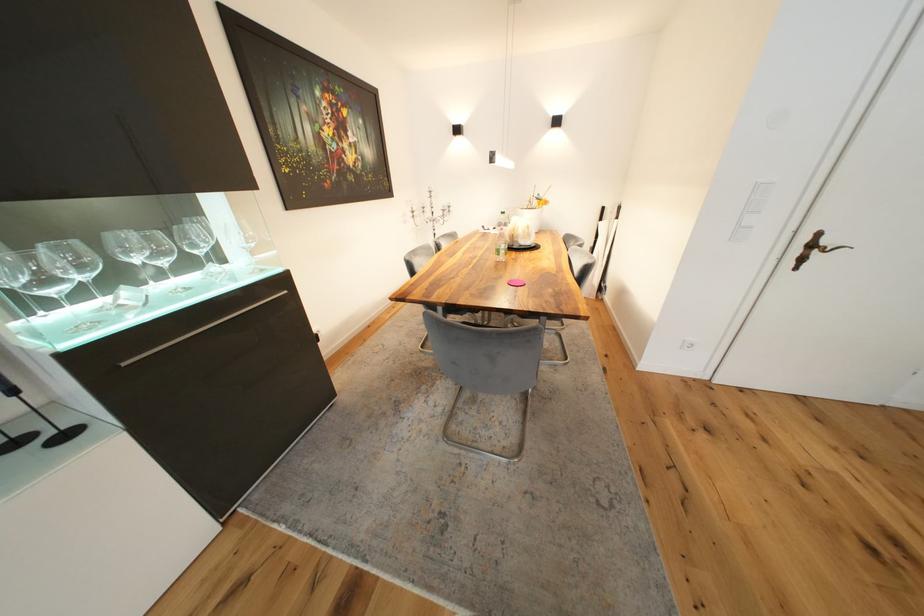
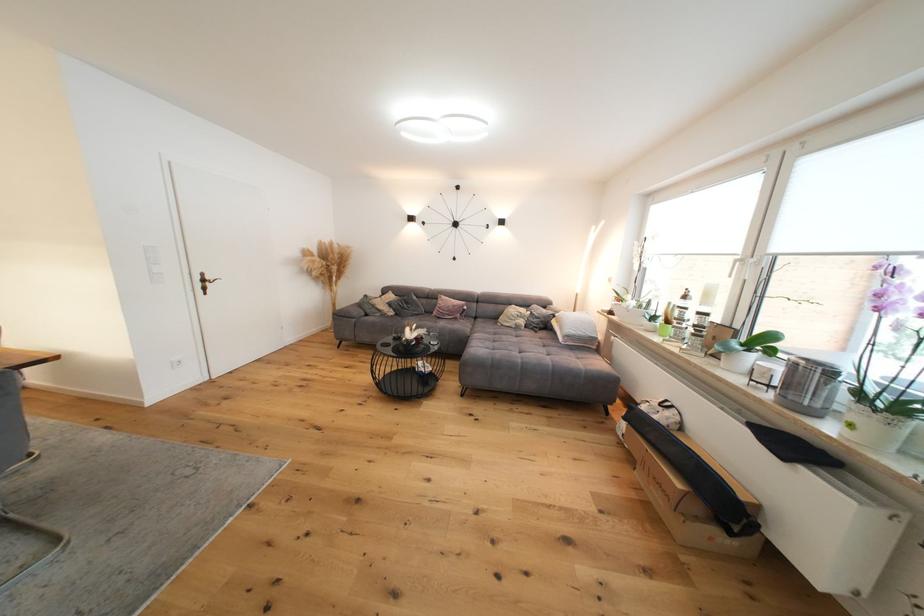
Locate, in the second image, the point that corresponds to (x=820, y=246) in the first image.

(211, 282)